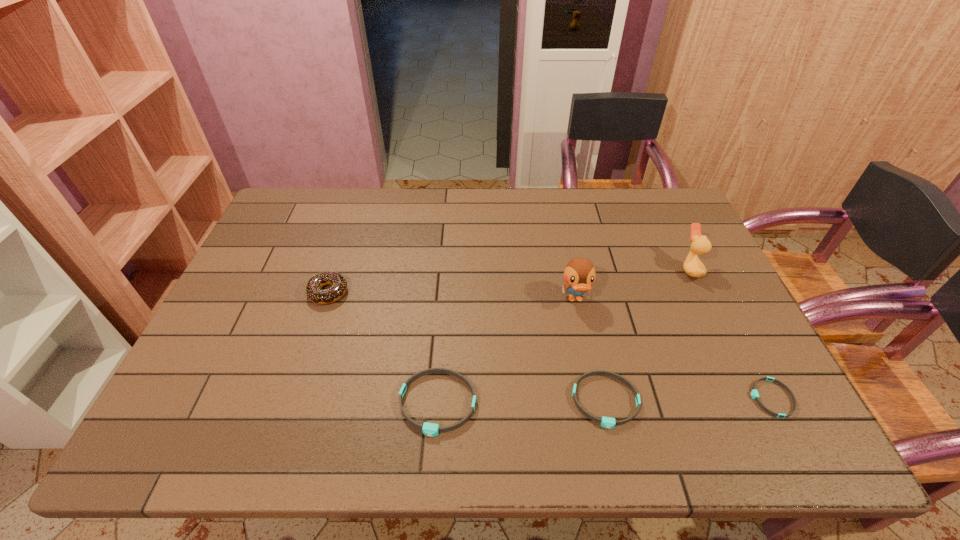
This screenshot has height=540, width=960. Find the location of `free spot that satisfies the following two spatial constraints: 1. on the buckle of the shortest object; 2. on the buckle of the leftmost wristband`. free spot that satisfies the following two spatial constraints: 1. on the buckle of the shortest object; 2. on the buckle of the leftmost wristband is located at coordinates (x=775, y=403).

Find the location of `vacant position in the image that satisfies the following two spatial constraints: 1. on the beak of the farther duck; 2. on the buckle of the leftmost wristband`. vacant position in the image that satisfies the following two spatial constraints: 1. on the beak of the farther duck; 2. on the buckle of the leftmost wristband is located at coordinates (755, 403).

This screenshot has height=540, width=960. Find the location of `free spot that satisfies the following two spatial constraints: 1. on the buckle of the rightmost wristband; 2. on the buckle of the fifth tallest object`. free spot that satisfies the following two spatial constraints: 1. on the buckle of the rightmost wristband; 2. on the buckle of the fifth tallest object is located at coordinates (773, 401).

The image size is (960, 540). In order to click on free space that satisfies the following two spatial constraints: 1. on the buckle of the rightmost wristband; 2. on the buckle of the second tallest wristband in this screenshot , I will do `click(773, 401)`.